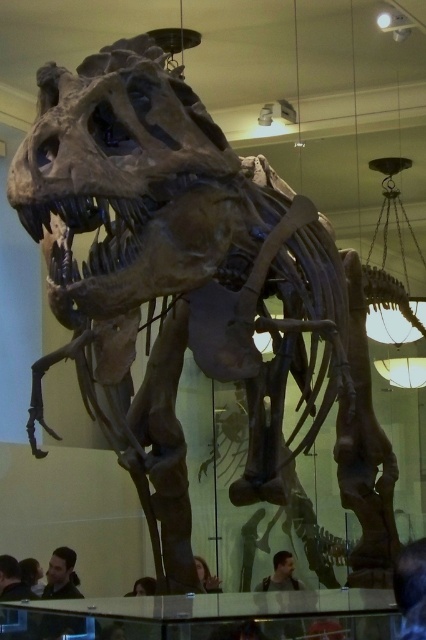
Between dark hair at lower right and dark brown leather jacket at lower center, which one appears on the right side from the viewer's perspective?

From the viewer's perspective, dark hair at lower right appears more on the right side.

Who is lower down, dark hair at lower right or dark brown leather jacket at lower center?

dark brown leather jacket at lower center is below.

Who is more forward, (402, 560) or (273, 556)?

Point (402, 560) is more forward.

Find the location of `dark hair at lower right`. dark hair at lower right is located at coordinates click(411, 588).

Does dark hair at lower right lie behind dark brown hair at lower left?

No.

Does point (402, 600) come farther from viewer compared to point (23, 595)?

No.

The height and width of the screenshot is (640, 426). I want to click on dark hair at lower right, so click(x=411, y=588).

Does dark brown hair at lower left have a lesser width compared to dark brown leather jacket at lower center?

Incorrect, dark brown hair at lower left's width is not less than dark brown leather jacket at lower center's.

Does dark brown hair at lower left lie in front of dark brown leather jacket at lower center?

No.

This screenshot has height=640, width=426. Identify the location of dark brown hair at lower left. (11, 580).